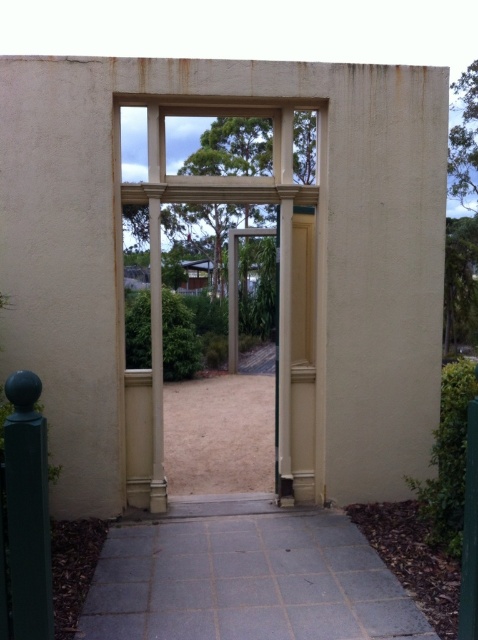
You are a painter who needs to decide which object to paint first. The beige stone door at center and the dark green polished post at left are both in your current view. Based on their sizes, which one should you tackle first?

The beige stone door at center has a greater height compared to the dark green polished post at left, so you should paint the beige stone door at center first because it is taller and may require more time and effort.

You are a delivery person trying to enter the beige stone door at center. There is a dark green polished post at left blocking your path. Can you walk around it to reach the door?

The beige stone door at center is larger in size than dark green polished post at left, so the post is smaller. Since the post is smaller, you can walk around it to reach the beige stone door at center.

Consider the image. You are a delivery person approaching the entrance of the building. You need to place a heavy box on the gray concrete path at center and the dark green polished post at left. Which surface can support the weight of the box better?

The gray concrete path at center is larger in size than the dark green polished post at left, so it can support the weight of the box better.